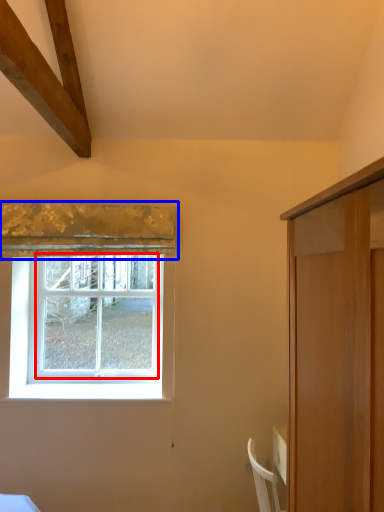
Question: Which of the following is the farthest to the observer, window (highlighted by a red box) or curtain (highlighted by a blue box)?

Choices:
 (A) window
 (B) curtain

Answer: (A)